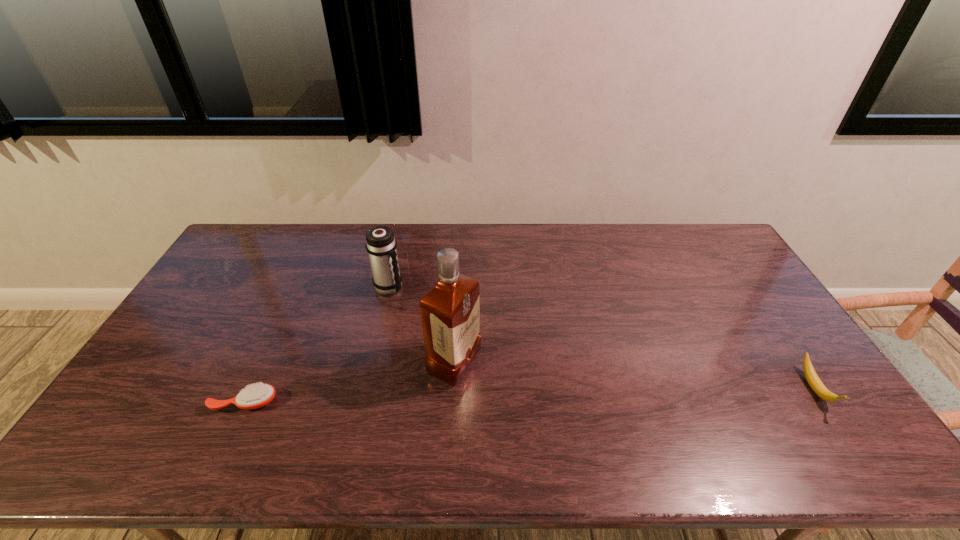
The image size is (960, 540). In order to click on free space between the leftmost object and the second object from right to left in this screenshot , I will do `click(349, 383)`.

The width and height of the screenshot is (960, 540). Find the location of `free space between the rightmost object and the thermos bottle`. free space between the rightmost object and the thermos bottle is located at coordinates (602, 338).

At what (x,y) coordinates should I click in order to perform the action: click on vacant area that lies between the rightmost object and the shortest object. Please return your answer as a coordinate pair (x, y). The height and width of the screenshot is (540, 960). Looking at the image, I should click on (530, 395).

The image size is (960, 540). Identify the location of vacant region between the leftmost object and the third shortest object. (317, 345).

The width and height of the screenshot is (960, 540). What are the coordinates of `object that is the closest one to the leftmost object` in the screenshot? It's located at (450, 311).

Where is `the third closest object to the rightmost object`? the third closest object to the rightmost object is located at coordinates (255, 396).